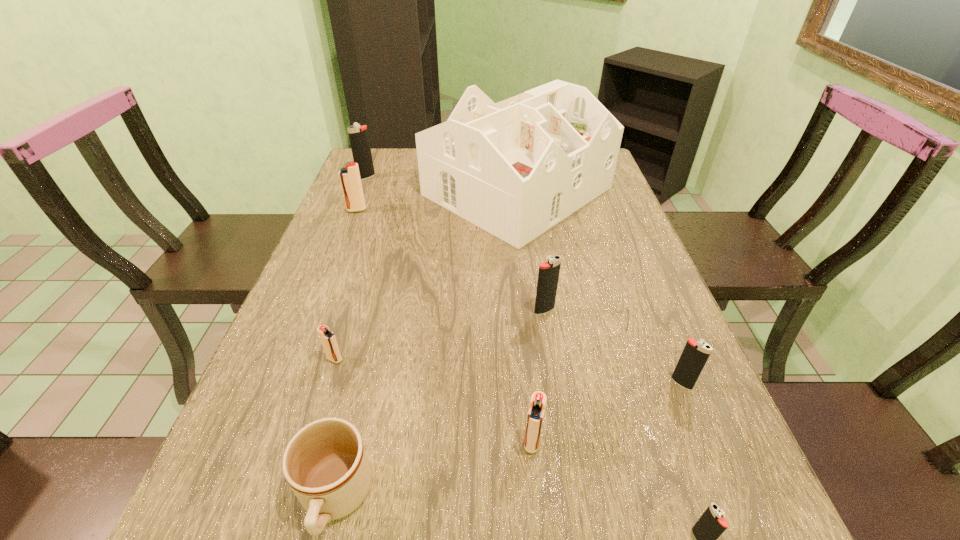
Choose which black igniter is the nearest neighbor to the third nearest black igniter. Please provide its 2D coordinates. Your answer should be formatted as a tuple, i.e. [(x, y)], where the tuple contains the x and y coordinates of a point satisfying the conditions above.

[(695, 354)]

Identify the location of red igniter that stands as the third closest to the farthest black igniter. This screenshot has width=960, height=540. (536, 411).

Where is `red igniter that is the third closest to the third black igniter from left to right`? red igniter that is the third closest to the third black igniter from left to right is located at coordinates (350, 180).